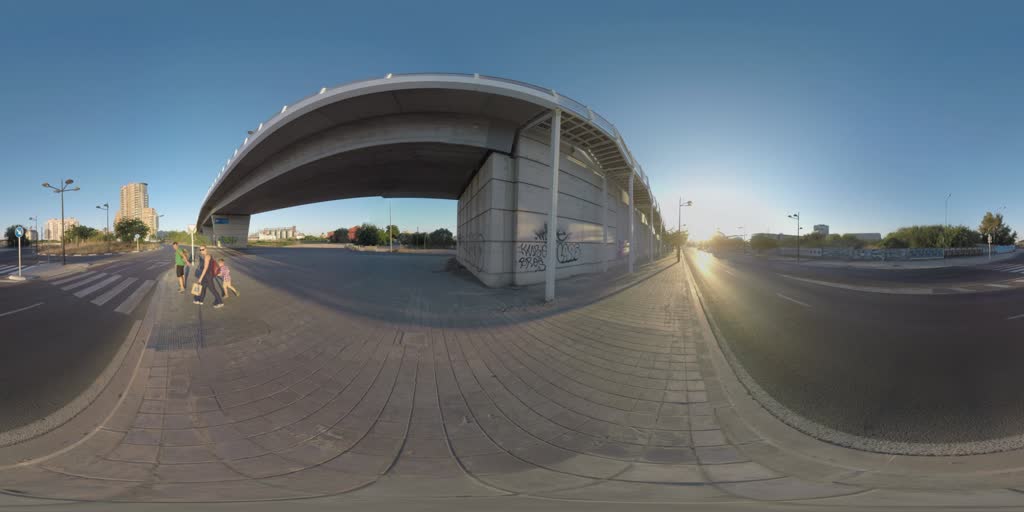
Find the location of a particular element. corner is located at coordinates (782, 369).